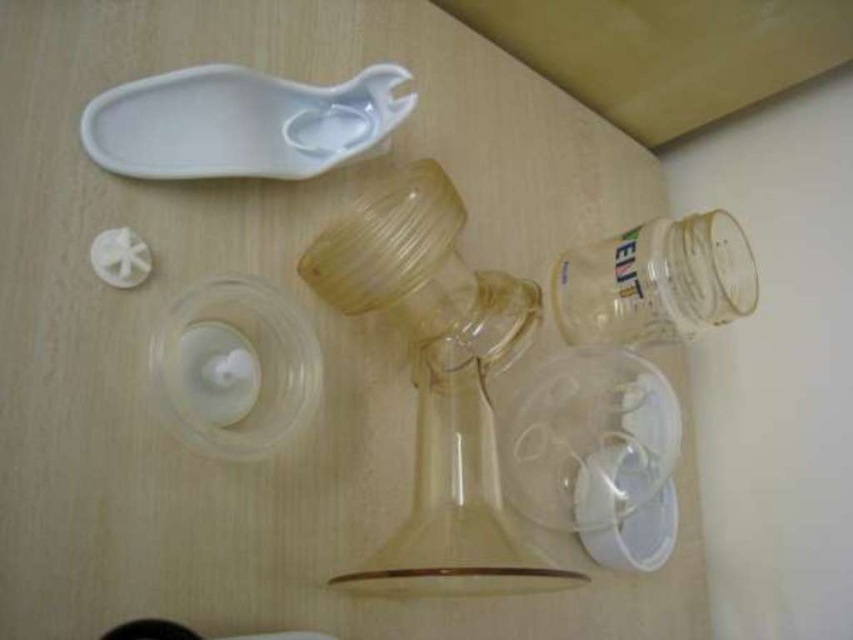
Question: Does translucent plastic glass vase at center come in front of transparent plastic jar at lower right?

Choices:
 (A) no
 (B) yes

Answer: (B)

Question: Which point is closer to the camera?

Choices:
 (A) transparent plastic jar at lower right
 (B) translucent plastic glass vase at center

Answer: (B)

Question: Can you confirm if translucent plastic glass vase at center is wider than transparent plastic jar at lower right?

Choices:
 (A) yes
 (B) no

Answer: (A)

Question: Which point is farther from the camera taking this photo?

Choices:
 (A) (440, 180)
 (B) (688, 237)

Answer: (B)

Question: In this image, where is translucent plastic glass vase at center located relative to transparent plastic jar at lower right?

Choices:
 (A) below
 (B) above

Answer: (A)